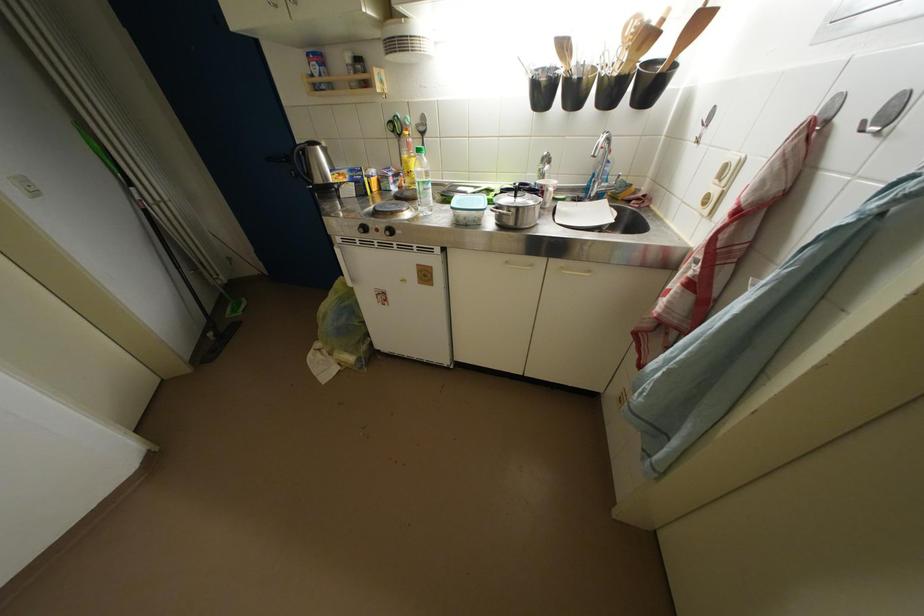
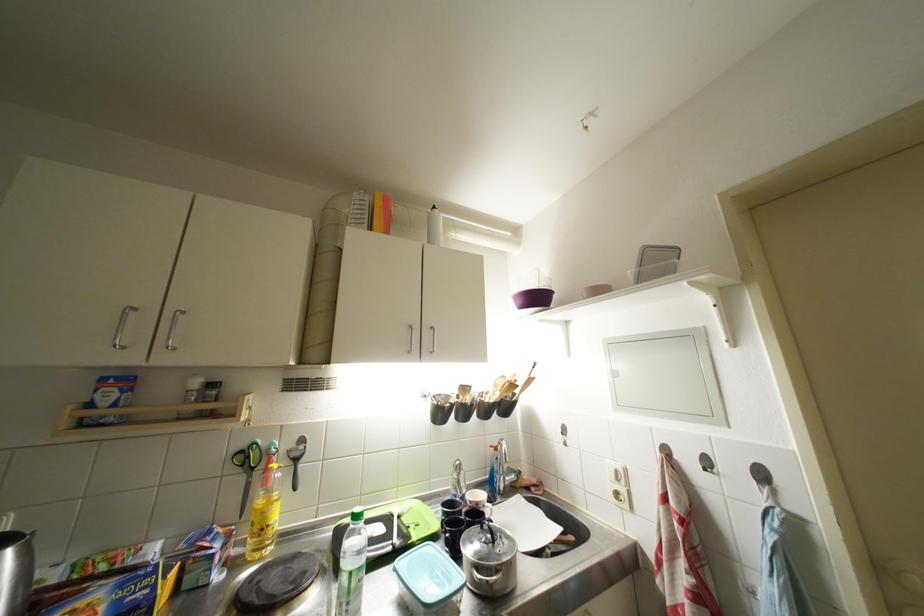
Find the pixel in the second image that matches point 426,126 in the first image.

(299, 450)